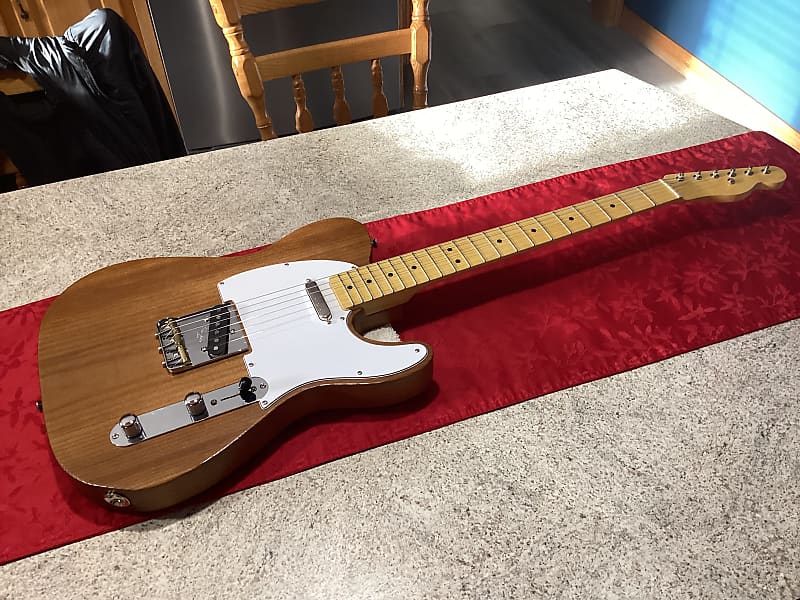
This screenshot has height=600, width=800. What are the coordinates of `table` in the screenshot? It's located at (468, 493).